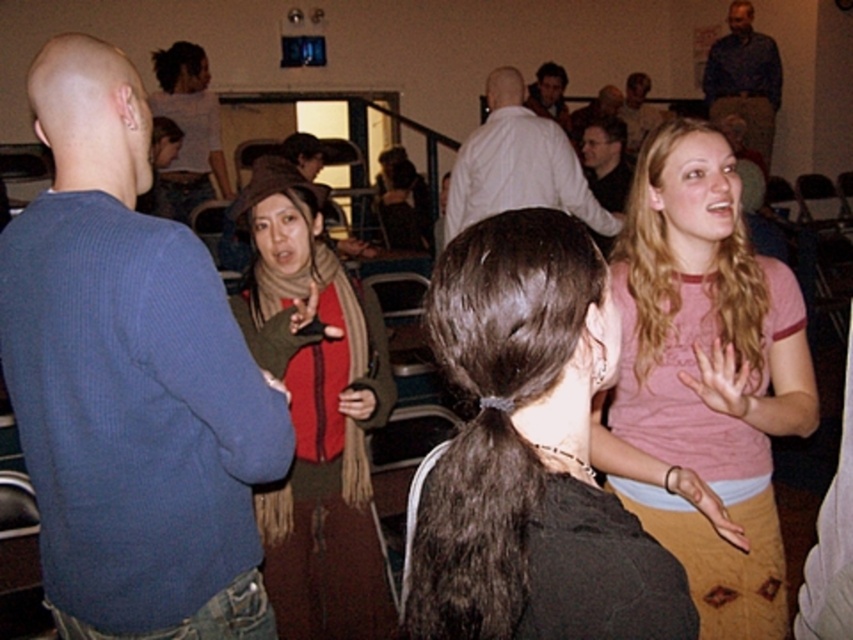
Question: Which point is closer to the camera?

Choices:
 (A) knitted brown hat at center
 (B) dark brown hair at center
 (C) dark blue shirt at upper right
 (D) matte black jacket at upper center

Answer: (B)

Question: In this image, where is blue ribbed sweater at left located relative to matte white shirt at center?

Choices:
 (A) above
 (B) below

Answer: (B)

Question: Among these objects, which one is farthest from the camera?

Choices:
 (A) blue ribbed sweater at left
 (B) smooth brown shirt at upper center
 (C) matte white shirt at center

Answer: (C)

Question: Is pink cotton shirt at upper right wider than smooth brown shirt at upper center?

Choices:
 (A) no
 (B) yes

Answer: (A)

Question: Is the position of knitted brown hat at center more distant than that of matte white shirt at center?

Choices:
 (A) no
 (B) yes

Answer: (A)

Question: Estimate the real-world distances between objects in this image. Which object is closer to the dark blue shirt at upper right?

Choices:
 (A) dark brown hair at center
 (B) knitted brown hat at center
 (C) matte white shirt at center

Answer: (C)